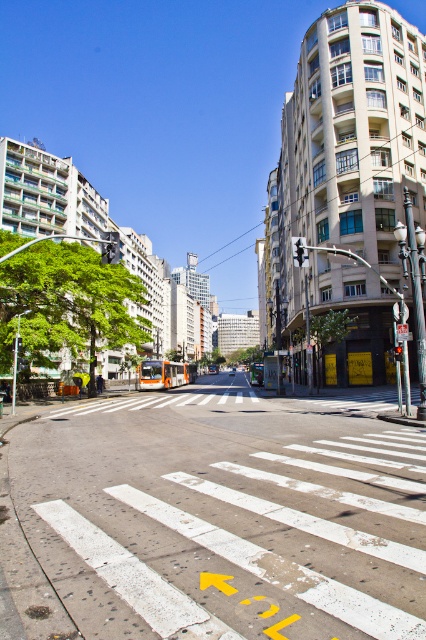
Question: Can you confirm if white painted crosswalk at center is positioned above metallic traffic light at center?

Choices:
 (A) yes
 (B) no

Answer: (B)

Question: In this image, where is white painted crosswalk at center located relative to red glass traffic light at center?

Choices:
 (A) below
 (B) above

Answer: (A)

Question: Which object appears farthest from the camera in this image?

Choices:
 (A) red glass traffic light at center
 (B) metallic traffic light at center
 (C) white painted crosswalk at center

Answer: (A)

Question: Which object appears farthest from the camera in this image?

Choices:
 (A) metallic traffic light at center
 (B) red glass traffic light at center

Answer: (B)

Question: Does white painted crosswalk at center have a larger size compared to metallic traffic light at center?

Choices:
 (A) no
 (B) yes

Answer: (B)

Question: Which object is positioned farthest from the white painted crosswalk at center?

Choices:
 (A) metallic traffic light at center
 (B) red glass traffic light at center

Answer: (B)